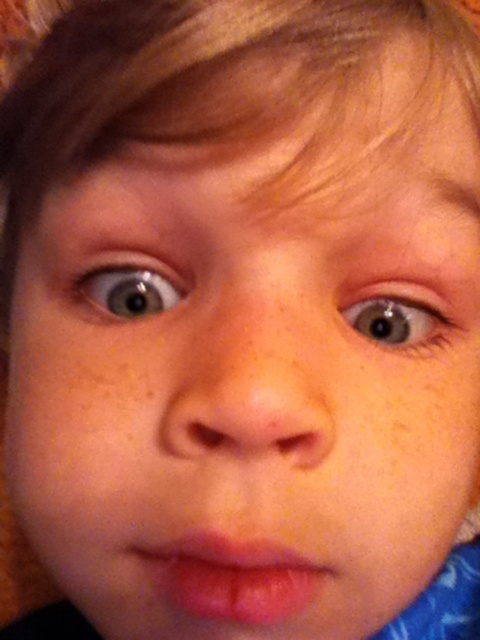
Is pink glossy lips at center taller than blue glossy eye at center?

Yes, pink glossy lips at center is taller than blue glossy eye at center.

Which is above, pink glossy lips at center or blue glossy eye at center?

blue glossy eye at center is higher up.

Is point (322, 566) positioned before point (385, 346)?

That is True.

You are a GUI agent. You are given a task and a screenshot of the screen. Output one action in this format:
    pyautogui.click(x=<x>, y=<y>)
    Task: Click on the pink glossy lips at center
    
    Given the screenshot: What is the action you would take?
    pyautogui.click(x=233, y=579)

Is point (237, 385) positioned before point (427, 332)?

That is True.

Which is above, smooth skin nose at center or blue glossy eye at center?

Positioned higher is blue glossy eye at center.

Who is more forward, (213, 376) or (379, 342)?

Point (213, 376) is in front.

At what (x,y) coordinates should I click in order to perform the action: click on smooth skin nose at center. Please return your answer as a coordinate pair (x, y). The height and width of the screenshot is (640, 480). Looking at the image, I should click on (247, 388).

In the scene shown: Is smooth skin nose at center thinner than light brown eye at upper center?

Incorrect, smooth skin nose at center's width is not less than light brown eye at upper center's.

Is smooth skin nose at center behind light brown eye at upper center?

No, smooth skin nose at center is closer to the viewer.

Measure the distance between point [307,438] and camera.

8.00 inches

Locate an element on the screen. Image resolution: width=480 pixels, height=640 pixels. smooth skin nose at center is located at coordinates (247, 388).